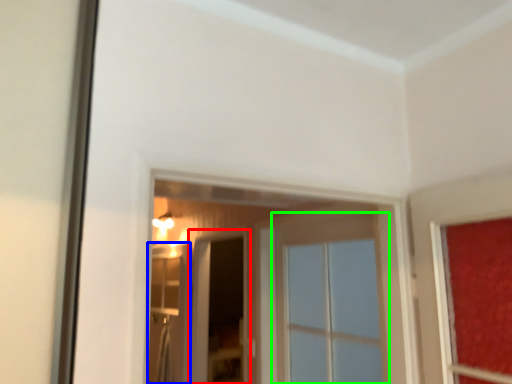
Question: Based on their relative distances, which object is farther from screen door (highlighted by a red box)? Choose from screen door (highlighted by a blue box) and window (highlighted by a green box).

Choices:
 (A) screen door
 (B) window

Answer: (B)